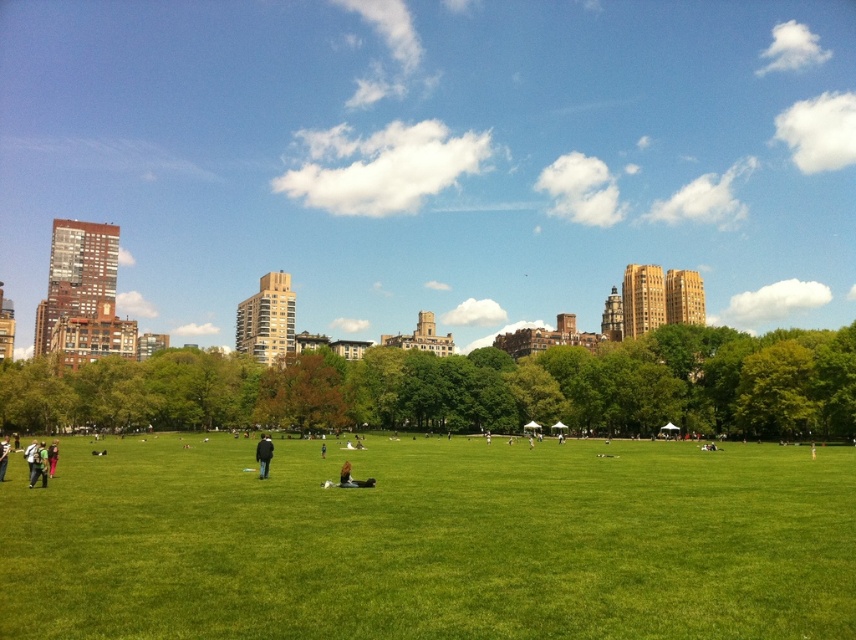
Question: Which of the following is the farthest from the observer?

Choices:
 (A) (262, 470)
 (B) (586, 596)
 (C) (46, 461)
 (D) (373, 477)

Answer: (A)

Question: Which point appears farthest from the camera in this image?

Choices:
 (A) (272, 468)
 (B) (40, 444)

Answer: (B)

Question: Does dark blue jeans at lower left appear under black leather jacket at center?

Choices:
 (A) yes
 (B) no

Answer: (A)

Question: Does green grass at center have a lesser width compared to black leather jacket at center?

Choices:
 (A) yes
 (B) no

Answer: (B)

Question: Does green grass at center appear on the right side of dark blue jeans at lower left?

Choices:
 (A) yes
 (B) no

Answer: (A)

Question: Which point is closer to the camera?

Choices:
 (A) (34, 483)
 (B) (354, 481)
 (C) (238, 513)
 (D) (266, 440)

Answer: (C)